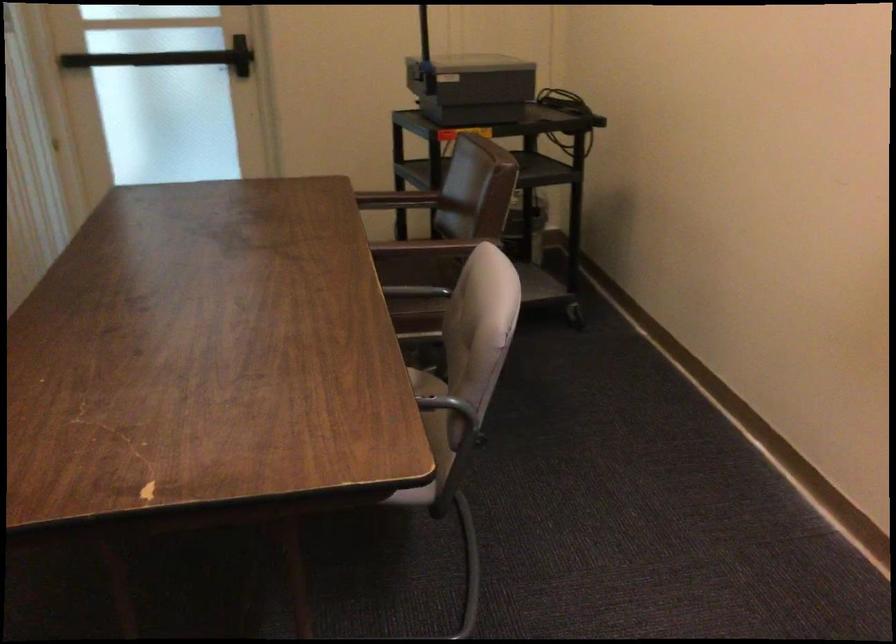
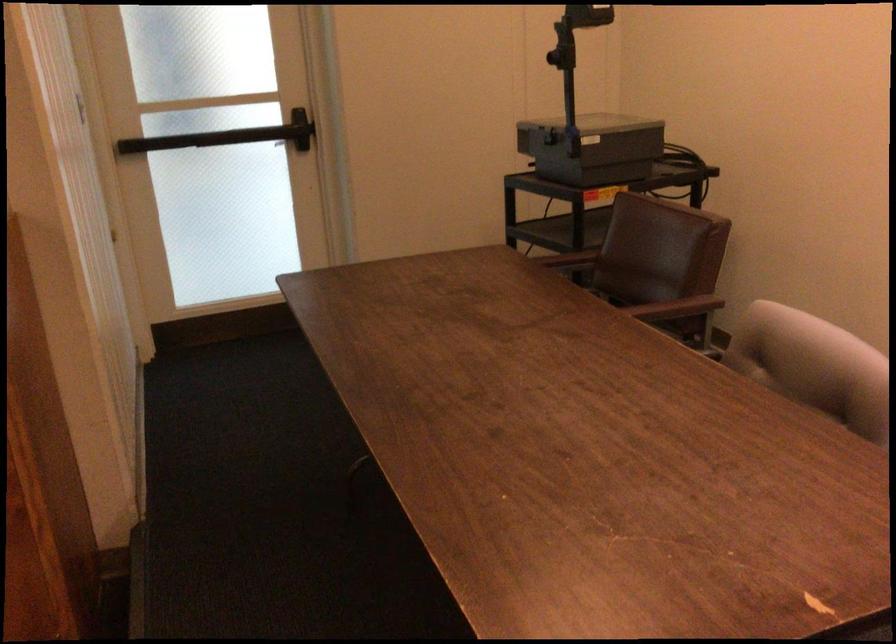
Locate, in the second image, the point that corresponds to the point at 449,251 in the first image.

(677, 308)